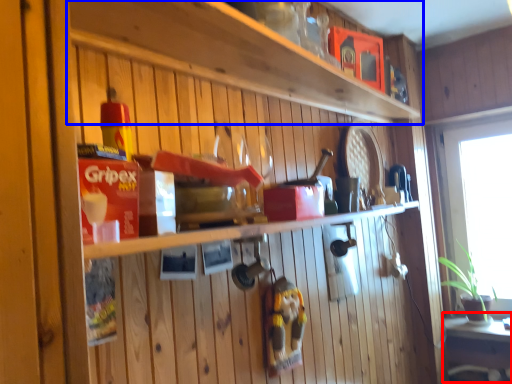
Question: Which object appears closest to the camera in this image, table (highlighted by a red box) or shelf (highlighted by a blue box)?

Choices:
 (A) table
 (B) shelf

Answer: (B)